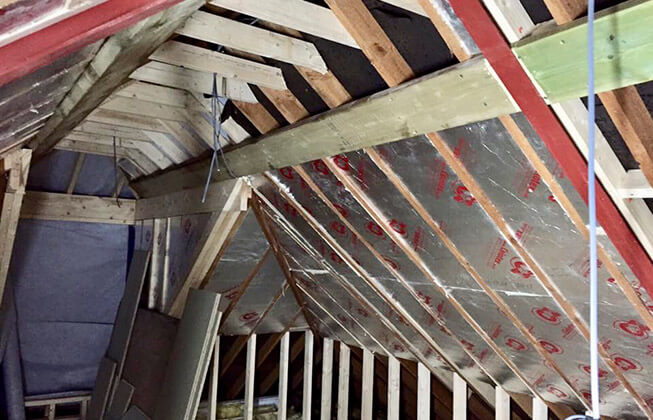
What are the coordinates of `wooden beams` in the screenshot? It's located at (292, 18), (277, 44), (242, 75), (234, 89).